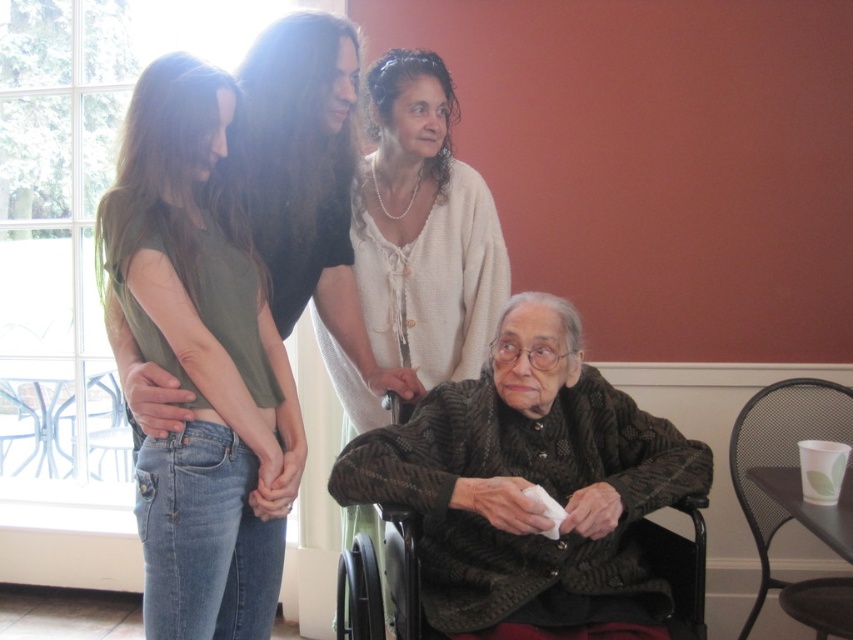
Question: Is white lace blouse at center bigger than dark gray fabric wheelchair at lower center?

Choices:
 (A) yes
 (B) no

Answer: (A)

Question: Based on their relative distances, which object is nearer to the black mesh chair at lower right?

Choices:
 (A) white lace blouse at center
 (B) dark gray fabric wheelchair at lower center
 (C) green cotton shirt at left

Answer: (A)

Question: Does green cotton shirt at left appear on the right side of black mesh chair at lower right?

Choices:
 (A) no
 (B) yes

Answer: (A)

Question: Which of the following is the closest to the observer?

Choices:
 (A) dark gray fabric wheelchair at lower center
 (B) green cotton shirt at left

Answer: (B)

Question: Can you confirm if white lace blouse at center is bigger than black mesh chair at lower right?

Choices:
 (A) yes
 (B) no

Answer: (A)

Question: Which of the following is the closest to the observer?

Choices:
 (A) (399, 358)
 (B) (817, 412)
 (C) (230, 108)

Answer: (C)